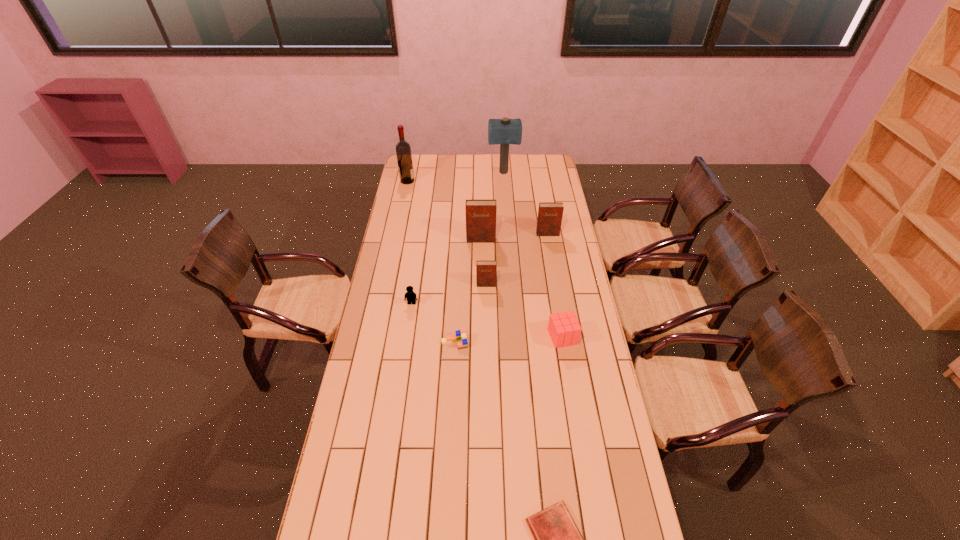
The width and height of the screenshot is (960, 540). In the image, there is a desktop. What are the coordinates of `vacant space at the far left corner` in the screenshot? It's located at (429, 158).

At what (x,y) coordinates should I click in order to perform the action: click on free area in between the cube and the sixth shortest object. Please return your answer as a coordinate pair (x, y). The width and height of the screenshot is (960, 540). Looking at the image, I should click on (555, 285).

Where is `free point between the brown mallet and the red cube`? This screenshot has height=540, width=960. free point between the brown mallet and the red cube is located at coordinates (533, 255).

Where is `vacant area that lies between the red cube and the green alcohol`? vacant area that lies between the red cube and the green alcohol is located at coordinates (485, 259).

I want to click on object that can be found as the fifth closest to the green alcohol, so click(x=410, y=296).

Identify the location of the fifth closest object to the second farthest reddish-brown diary. The image size is (960, 540). (564, 329).

Locate an element on the screen. the third closest diary to the red diary is located at coordinates (550, 214).

Locate an element on the screen. The width and height of the screenshot is (960, 540). the second closest diary relative to the shortest object is located at coordinates (480, 214).

Identify which reddish-brown diary is the third nearest to the green alcohol. Please provide its 2D coordinates. Your answer should be formatted as a tuple, i.e. [(x, y)], where the tuple contains the x and y coordinates of a point satisfying the conditions above.

[(485, 270)]

The image size is (960, 540). I want to click on reddish-brown diary that stands as the closest to the second shortest diary, so click(480, 214).